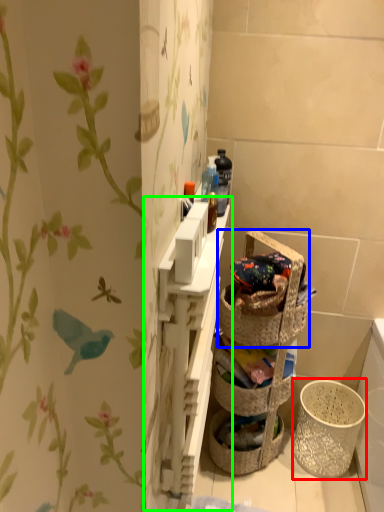
Question: Which is farther away from basket container (highlighted by a red box)? picnic basket (highlighted by a blue box) or cabinet (highlighted by a green box)?

Choices:
 (A) picnic basket
 (B) cabinet

Answer: (B)